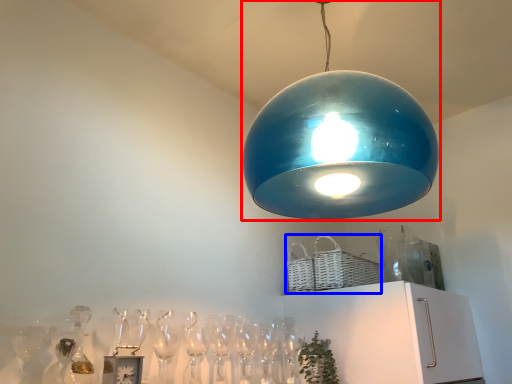
Question: Which object appears farthest to the camera in this image, lamp (highlighted by a red box) or basket (highlighted by a blue box)?

Choices:
 (A) lamp
 (B) basket

Answer: (B)